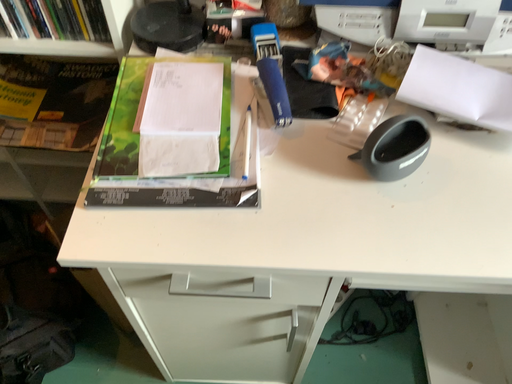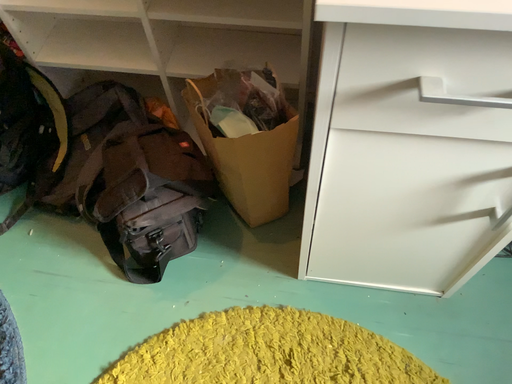
Question: Which way did the camera rotate in the video?

Choices:
 (A) rotated left
 (B) rotated right

Answer: (A)